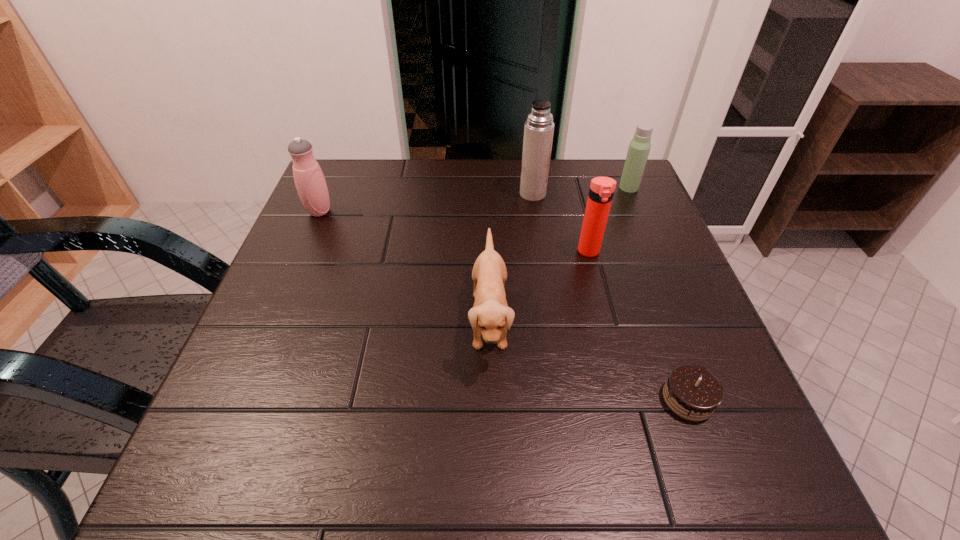
This screenshot has width=960, height=540. What are the coordinates of `vacant space that's between the third object from left to right and the third farthest object` in the screenshot? It's located at (426, 202).

At what (x,y) coordinates should I click in order to perform the action: click on vacant space that is in between the tallest object and the nearest thermos bottle. Please return your answer as a coordinate pair (x, y). Looking at the image, I should click on (561, 223).

Find the location of a particular element. Image resolution: width=960 pixels, height=540 pixels. free spot between the fourth nearest object and the puppy is located at coordinates (404, 265).

Where is `vacant space that is in between the fourth object from left to right and the second nearest thermos bottle`? This screenshot has width=960, height=540. vacant space that is in between the fourth object from left to right and the second nearest thermos bottle is located at coordinates (454, 232).

Image resolution: width=960 pixels, height=540 pixels. What are the coordinates of `free area in between the third object from left to right and the fourth object from left to right` in the screenshot? It's located at (561, 223).

I want to click on vacant region between the rightmost thermos bottle and the fifth object from right to left, so click(559, 253).

The image size is (960, 540). What are the coordinates of `free space between the second nearest thermos bottle and the fifth object from right to left` in the screenshot? It's located at coord(404,265).

The width and height of the screenshot is (960, 540). In order to click on vacant point located between the second thermos bottle from left to right and the rightmost thermos bottle in this screenshot , I will do coord(581,191).

At what (x,y) coordinates should I click in order to perform the action: click on object that stands as the third closest to the second shortest object. Please return your answer as a coordinate pair (x, y). This screenshot has height=540, width=960. Looking at the image, I should click on (539, 127).

This screenshot has width=960, height=540. What are the coordinates of `the fourth closest object to the rightmost thermos bottle` in the screenshot? It's located at (692, 392).